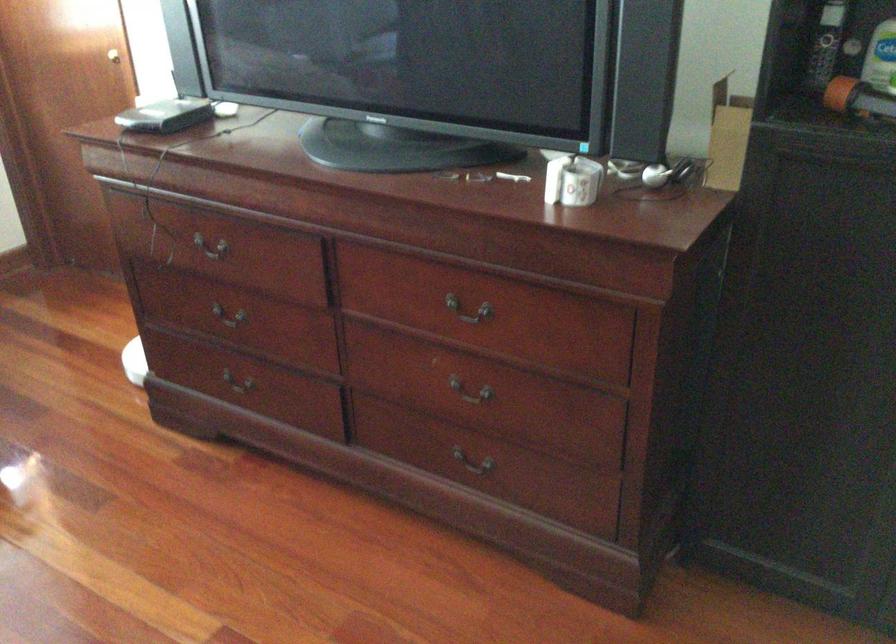
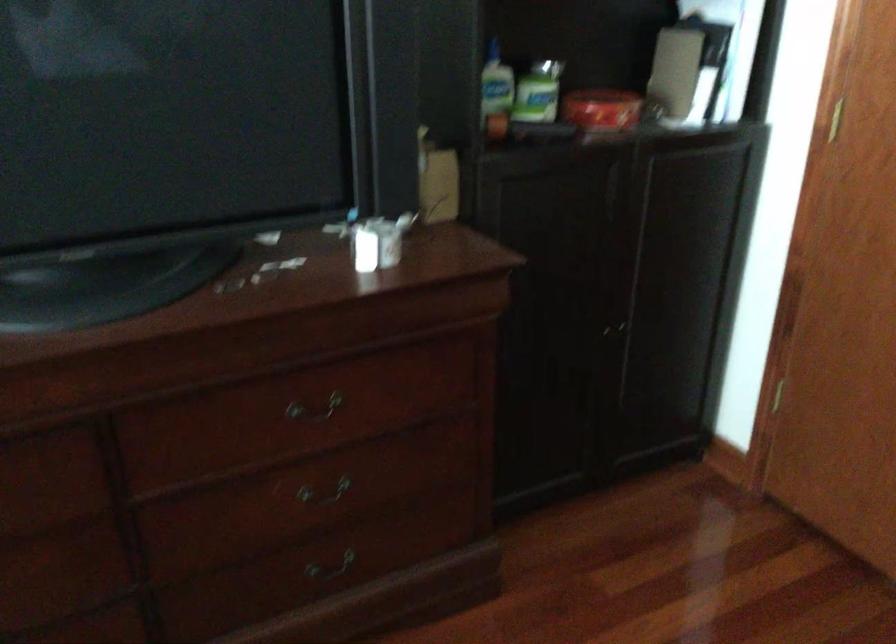
Find the pixel in the second image that matches (478,316) in the first image.

(314, 409)